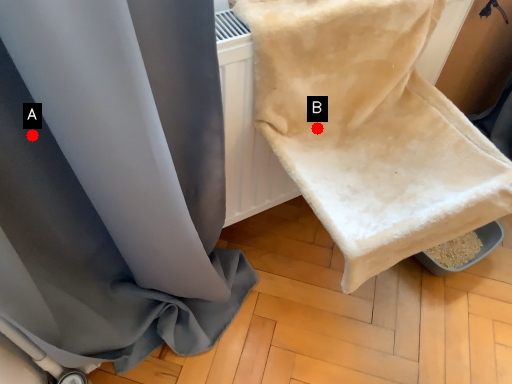
Question: Two points are circled on the image, labeled by A and B beside each circle. Which point is closer to the camera taking this photo?

Choices:
 (A) A is closer
 (B) B is closer

Answer: (A)